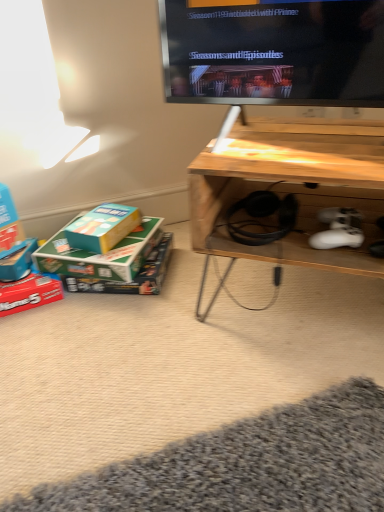
Question: From a real-world perspective, is teal cardboard box at lower left, arranged as the first box when viewed from the right, physically located above or below green cardboard box at lower left, the second box from the right?

Choices:
 (A) above
 (B) below

Answer: (A)

Question: Choose the correct answer: Is teal cardboard box at lower left, the fourth box in the left-to-right sequence, inside green cardboard box at lower left, the third box positioned from the left, or outside it?

Choices:
 (A) inside
 (B) outside

Answer: (B)

Question: Based on their relative distances, which object is farther from the green cardboard box at lower left, the third box positioned from the left?

Choices:
 (A) teal cardboard box at lower left, the fourth box in the left-to-right sequence
 (B) matte blue box at lower left, arranged as the fourth box when viewed from the right
 (C) wooden desk at lower right
 (D) matte red box at lower left, the third box from the right

Answer: (C)

Question: Which is nearer to the matte blue box at lower left, the first box viewed from the left?

Choices:
 (A) green cardboard box at lower left, the second box from the right
 (B) teal cardboard box at lower left, arranged as the first box when viewed from the right
 (C) wooden desk at lower right
 (D) matte red box at lower left, the third box from the right

Answer: (D)